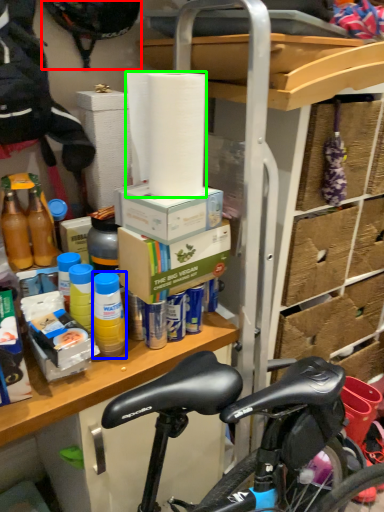
Question: Estimate the real-world distances between objects in this image. Which object is farther from bicycle helmet (highlighted by a red box), bottle (highlighted by a blue box) or paper towel (highlighted by a green box)?

Choices:
 (A) bottle
 (B) paper towel

Answer: (A)